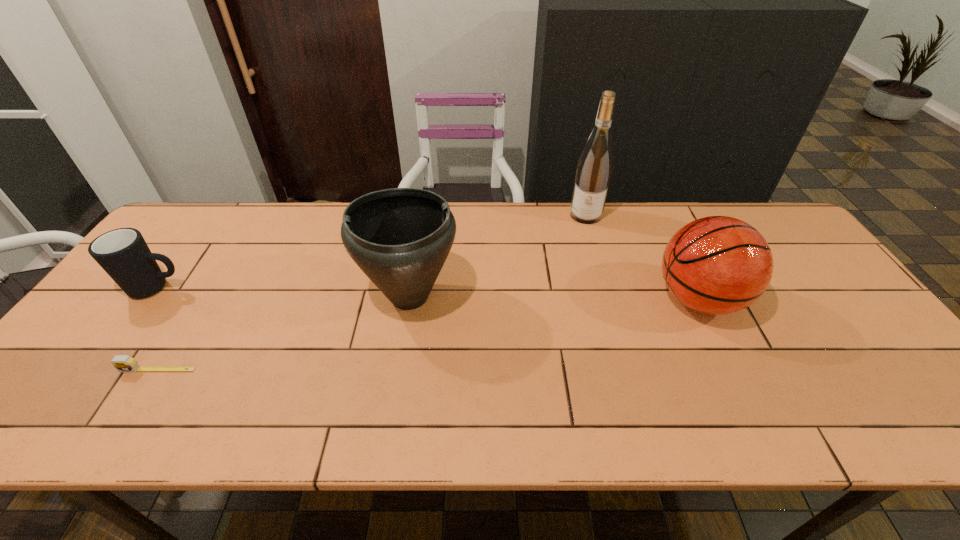
You are a GUI agent. You are given a task and a screenshot of the screen. Output one action in this format:
    pyautogui.click(x=<x>, y=<y>)
    Task: Click on the vacant space located 0.260m on the side with spill of the rightmost object
    The width and height of the screenshot is (960, 540).
    Given the screenshot: What is the action you would take?
    pyautogui.click(x=556, y=299)

Locate an element on the screen. The width and height of the screenshot is (960, 540). vacant space located on the side with spill of the rightmost object is located at coordinates (578, 299).

At what (x,y) coordinates should I click in order to perform the action: click on vacant area situated 0.200m on the side with spill of the rightmost object. Please return your answer as a coordinate pair (x, y). This screenshot has width=960, height=540. Looking at the image, I should click on (578, 299).

At what (x,y) coordinates should I click in order to perform the action: click on blank space located on the side of the fourth tallest object with the handle. Please return your answer as a coordinate pair (x, y). The width and height of the screenshot is (960, 540). Looking at the image, I should click on click(x=228, y=288).

Identify the location of vacant space situated at the front of the nearest object with the tape extended. The width and height of the screenshot is (960, 540). (123, 426).

Where is `object at the far edge`? This screenshot has width=960, height=540. object at the far edge is located at coordinates (594, 170).

Image resolution: width=960 pixels, height=540 pixels. I want to click on mug present at the left edge, so click(123, 253).

At what (x,y) coordinates should I click in order to perform the action: click on tape measure present at the left edge. Please return your answer as a coordinate pair (x, y). The height and width of the screenshot is (540, 960). Looking at the image, I should click on click(123, 363).

The height and width of the screenshot is (540, 960). I want to click on free space at the far edge of the desktop, so click(543, 228).

Image resolution: width=960 pixels, height=540 pixels. I want to click on blank space at the near edge of the desktop, so click(368, 420).